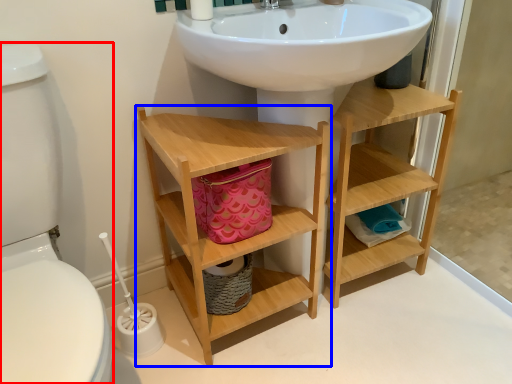
Question: Which object appears closest to the camera in this image, toilet bowl (highlighted by a red box) or bathroom cabinet (highlighted by a blue box)?

Choices:
 (A) toilet bowl
 (B) bathroom cabinet

Answer: (A)